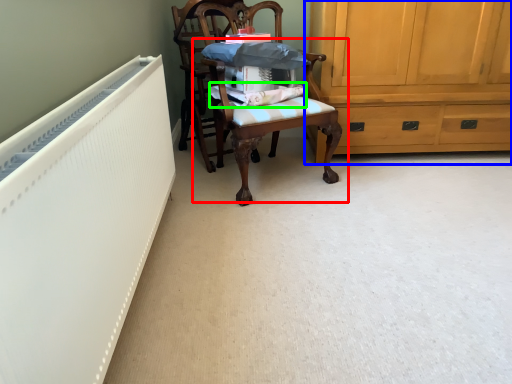
Question: Considering the real-world distances, which object is closest to chair (highlighted by a red box)? cabinetry (highlighted by a blue box) or fabric (highlighted by a green box).

Choices:
 (A) cabinetry
 (B) fabric

Answer: (B)